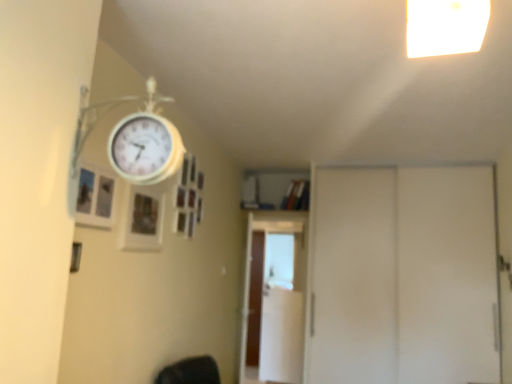
Question: Which direction should I rotate to face white glossy screen door at center, which ranks as the 2th screen door in front-to-back order, — up or down?

Choices:
 (A) up
 (B) down

Answer: (B)

Question: Which direction should I rotate to face wooden picture frame at upper center, marked as the 2th picture frame in a front-to-back arrangement, — up or down?

Choices:
 (A) up
 (B) down

Answer: (B)

Question: Can you confirm if brown wooden screen door at center, acting as the first screen door starting from the back, is smaller than white glossy screen door at center, marked as the second screen door in a left-to-right arrangement?

Choices:
 (A) yes
 (B) no

Answer: (B)

Question: Is brown wooden screen door at center, acting as the first screen door starting from the back, at the right side of white glossy screen door at center, which ranks as the 2th screen door in front-to-back order?

Choices:
 (A) yes
 (B) no

Answer: (B)

Question: Considering the relative sizes of brown wooden screen door at center, the third screen door when ordered from right to left, and white glossy screen door at center, marked as the second screen door in a left-to-right arrangement, in the image provided, is brown wooden screen door at center, the third screen door when ordered from right to left, taller than white glossy screen door at center, marked as the second screen door in a left-to-right arrangement,?

Choices:
 (A) no
 (B) yes

Answer: (B)

Question: Considering the relative sizes of brown wooden screen door at center, acting as the first screen door starting from the back, and white glossy screen door at center, which appears as the second screen door when viewed from the back, in the image provided, is brown wooden screen door at center, acting as the first screen door starting from the back, bigger than white glossy screen door at center, which appears as the second screen door when viewed from the back,?

Choices:
 (A) no
 (B) yes

Answer: (B)

Question: Does brown wooden screen door at center, the third screen door when ordered from right to left, have a greater width compared to white glossy screen door at center, marked as the second screen door in a left-to-right arrangement?

Choices:
 (A) no
 (B) yes

Answer: (B)

Question: Is the position of brown wooden screen door at center, the 3th screen door when ordered from front to back, more distant than that of white glossy screen door at center, which ranks as the 2th screen door in front-to-back order?

Choices:
 (A) yes
 (B) no

Answer: (A)

Question: Is wooden picture frame at upper center, the first picture frame when ordered from back to front, thinner than wooden picture frame at upper left, the second picture frame positioned from the right?

Choices:
 (A) yes
 (B) no

Answer: (A)

Question: From a real-world perspective, is wooden picture frame at upper center, the first picture frame when ordered from back to front, over wooden picture frame at upper left, marked as the first picture frame in a left-to-right arrangement?

Choices:
 (A) no
 (B) yes

Answer: (A)

Question: Does wooden picture frame at upper center, the first picture frame when ordered from back to front, have a greater width compared to wooden picture frame at upper left, arranged as the first picture frame when viewed from the front?

Choices:
 (A) yes
 (B) no

Answer: (B)

Question: Would you consider wooden picture frame at upper center, which is the first picture frame from right to left, to be distant from wooden picture frame at upper left, the second picture frame positioned from the right?

Choices:
 (A) no
 (B) yes

Answer: (A)

Question: Does wooden picture frame at upper center, which is the first picture frame from right to left, have a greater height compared to wooden picture frame at upper left, the second picture frame positioned from the right?

Choices:
 (A) no
 (B) yes

Answer: (B)

Question: Can you confirm if wooden picture frame at upper center, the first picture frame when ordered from back to front, is shorter than wooden picture frame at upper left, placed as the second picture frame when sorted from back to front?

Choices:
 (A) yes
 (B) no

Answer: (B)

Question: Can you confirm if brown wooden screen door at center, the 3th screen door when ordered from front to back, is wider than wooden picture frame at upper center, which is the first picture frame from right to left?

Choices:
 (A) no
 (B) yes

Answer: (B)